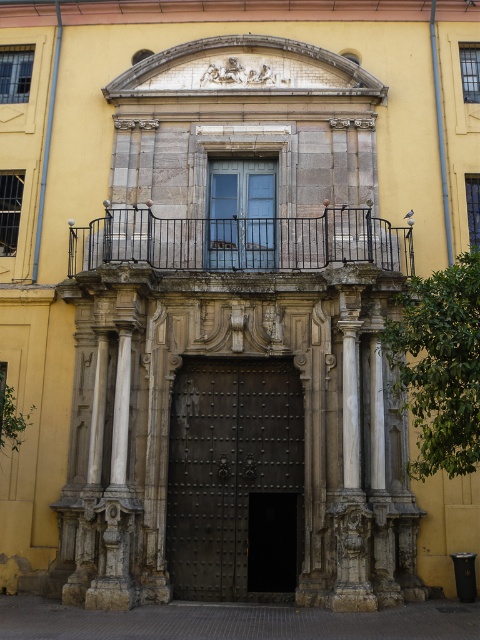
Question: Which object is closer to the camera taking this photo?

Choices:
 (A) dark brown metal gate at center
 (B) matte glass door at center

Answer: (A)

Question: Does dark brown metal gate at center have a greater width compared to black wrought iron balcony at upper center?

Choices:
 (A) yes
 (B) no

Answer: (B)

Question: Observing the image, what is the correct spatial positioning of black wrought iron balcony at upper center in reference to matte glass door at center?

Choices:
 (A) left
 (B) right

Answer: (A)

Question: Which point is closer to the camera?

Choices:
 (A) (252, 547)
 (B) (326, 220)

Answer: (A)

Question: Which is farther from the black wrought iron balcony at upper center?

Choices:
 (A) dark brown metal gate at center
 (B) matte glass door at center

Answer: (A)

Question: Can you confirm if dark brown metal gate at center is bigger than matte glass door at center?

Choices:
 (A) yes
 (B) no

Answer: (A)